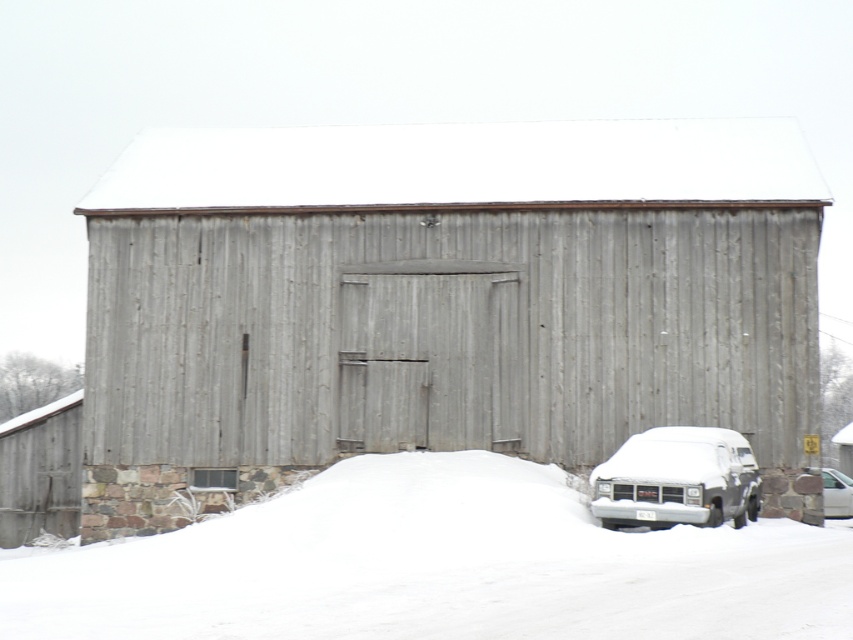
You are a delivery driver who needs to park your van near the barn. You see the white fluffy snow at lower center and the white matte van at lower right. Which location has enough space for your van to park without being buried under snow?

The white fluffy snow at lower center has a lesser height compared to the white matte van at lower right, so the white fluffy snow at lower center is lower and thus has enough space for the van to park without being buried under snow.